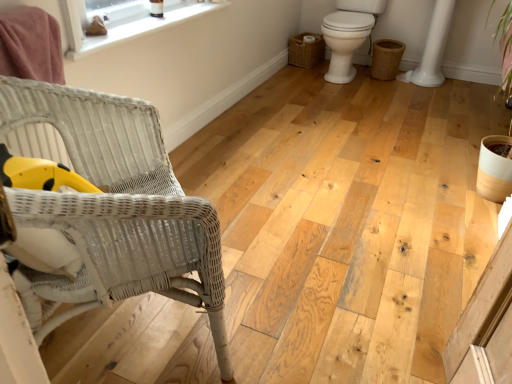
Locate an element on the screen. The image size is (512, 384). free space between white glossy toilet at right and woven brown basket at right, the second basket viewed from the right is located at coordinates (296, 74).